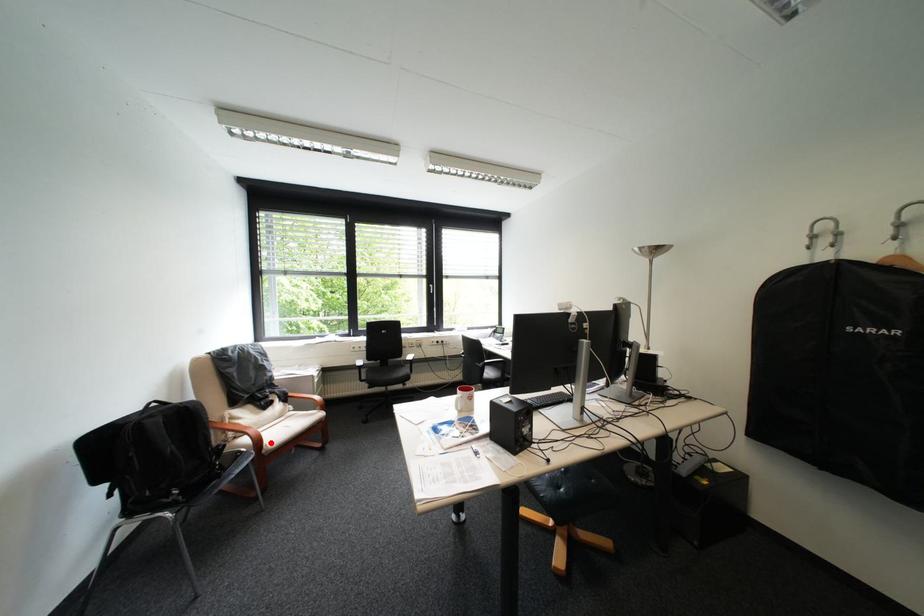
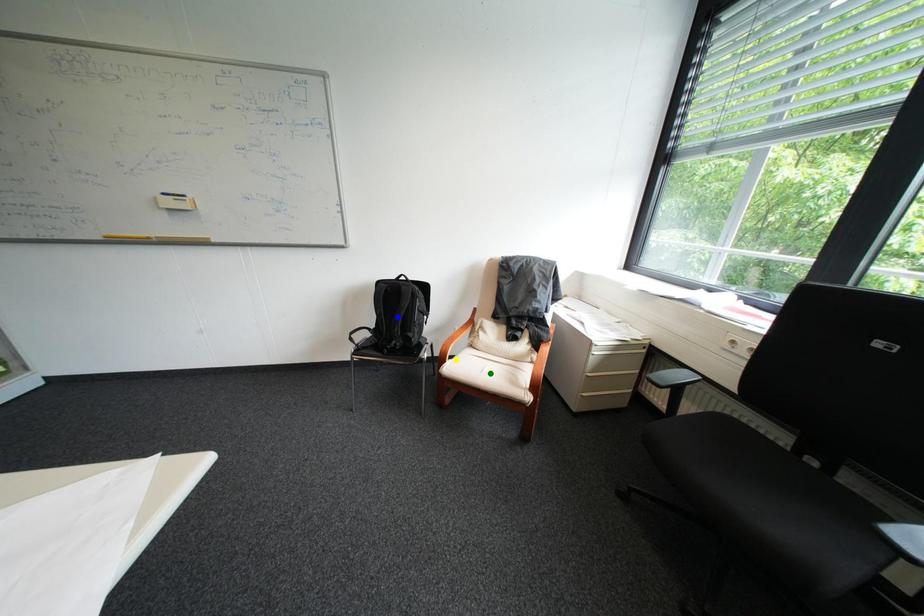
Question: I am providing you with two images of the same scene from different viewpoints. A red point is marked on the first image. You are given multiple points on the second image. In image 2, which mark is for the same physical point as the one in image 1?

Choices:
 (A) yellow point
 (B) green point
 (C) blue point

Answer: (A)